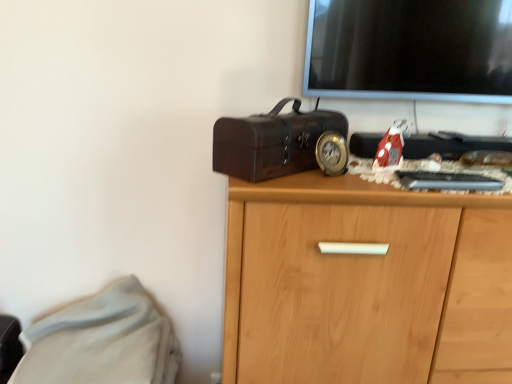
Question: Should I look upward or downward to see shiny dark brown suitcase at center?

Choices:
 (A) down
 (B) up

Answer: (B)

Question: Does light wood cabinet at center have a greater width compared to white soft fabric at lower left?

Choices:
 (A) yes
 (B) no

Answer: (B)

Question: Is light wood cabinet at center at the right side of white soft fabric at lower left?

Choices:
 (A) yes
 (B) no

Answer: (A)

Question: Is light wood cabinet at center next to white soft fabric at lower left?

Choices:
 (A) yes
 (B) no

Answer: (B)

Question: Would you say light wood cabinet at center is a long distance from white soft fabric at lower left?

Choices:
 (A) no
 (B) yes

Answer: (A)

Question: Can you confirm if light wood cabinet at center is smaller than white soft fabric at lower left?

Choices:
 (A) no
 (B) yes

Answer: (A)

Question: Could white soft fabric at lower left be considered to be inside light wood cabinet at center?

Choices:
 (A) yes
 (B) no

Answer: (B)

Question: From the image's perspective, is shiny dark brown suitcase at center under white soft fabric at lower left?

Choices:
 (A) yes
 (B) no

Answer: (B)

Question: From the image's perspective, would you say shiny dark brown suitcase at center is positioned over white soft fabric at lower left?

Choices:
 (A) no
 (B) yes

Answer: (B)

Question: Does shiny dark brown suitcase at center have a greater height compared to white soft fabric at lower left?

Choices:
 (A) no
 (B) yes

Answer: (A)

Question: Does shiny dark brown suitcase at center have a smaller size compared to white soft fabric at lower left?

Choices:
 (A) no
 (B) yes

Answer: (B)

Question: Considering the relative sizes of shiny dark brown suitcase at center and white soft fabric at lower left in the image provided, is shiny dark brown suitcase at center wider than white soft fabric at lower left?

Choices:
 (A) no
 (B) yes

Answer: (A)

Question: Is white soft fabric at lower left a part of shiny dark brown suitcase at center?

Choices:
 (A) yes
 (B) no

Answer: (B)

Question: Is white soft fabric at lower left turned away from light wood cabinet at center?

Choices:
 (A) yes
 (B) no

Answer: (B)